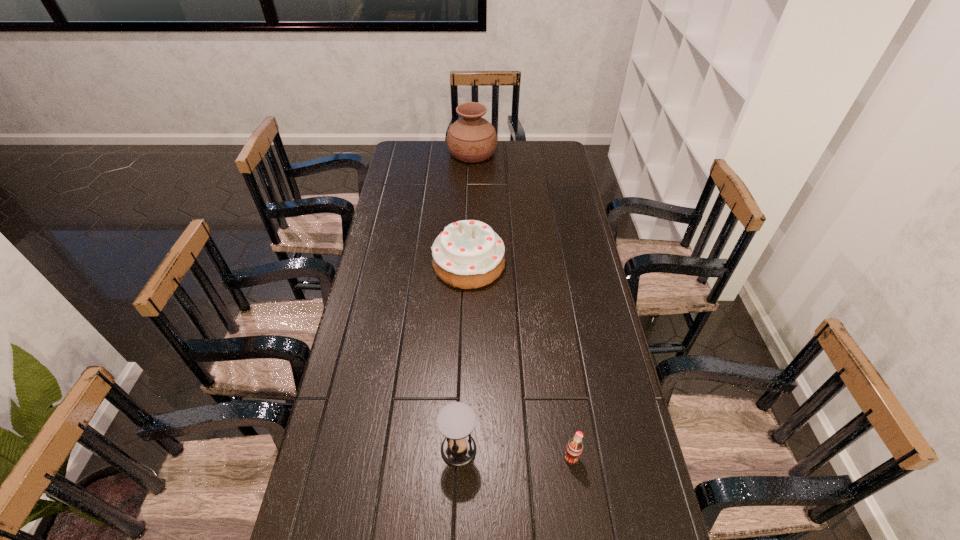
The image size is (960, 540). In order to click on urn in this screenshot , I will do `click(471, 139)`.

What are the coordinates of `the tallest object` in the screenshot? It's located at coord(471,139).

Find the location of `the second farthest object`. the second farthest object is located at coordinates (468, 254).

This screenshot has width=960, height=540. Identify the location of hourglass. (456, 420).

Where is `the rightmost object`? The image size is (960, 540). the rightmost object is located at coordinates (574, 448).

You are a GUI agent. You are given a task and a screenshot of the screen. Output one action in this format:
    pyautogui.click(x=<x>, y=<y>)
    Task: Click on the soda
    
    Given the screenshot: What is the action you would take?
    pyautogui.click(x=574, y=448)

Where is `free space located 0.180m on the left of the farthest object`? free space located 0.180m on the left of the farthest object is located at coordinates (411, 153).

The width and height of the screenshot is (960, 540). What are the coordinates of `vacant space situated 0.130m on the front of the second farthest object` in the screenshot? It's located at (468, 320).

Where is `free location located on the right of the hourglass`? free location located on the right of the hourglass is located at coordinates 573,449.

Find the location of `free space located on the front of the rightmost object`. free space located on the front of the rightmost object is located at coordinates (580, 522).